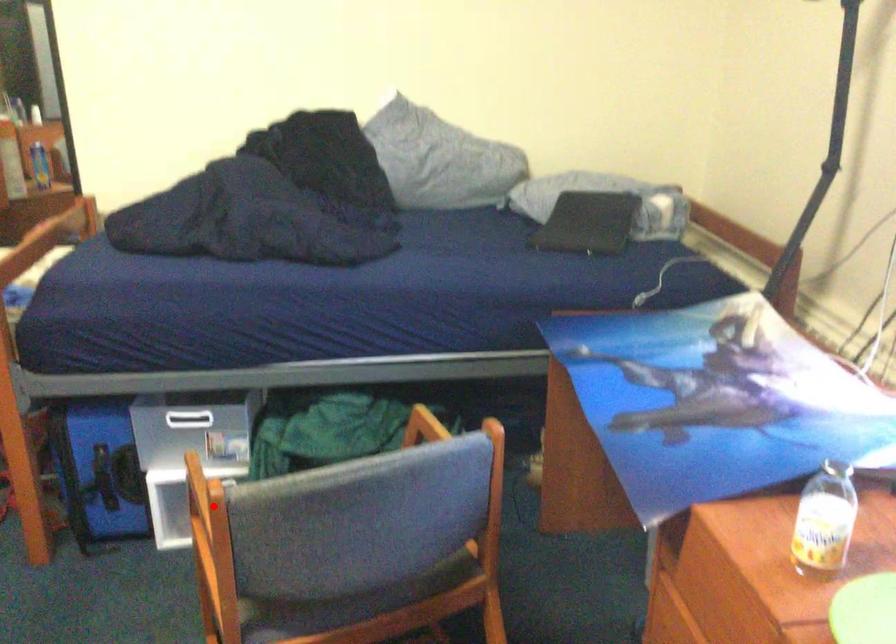
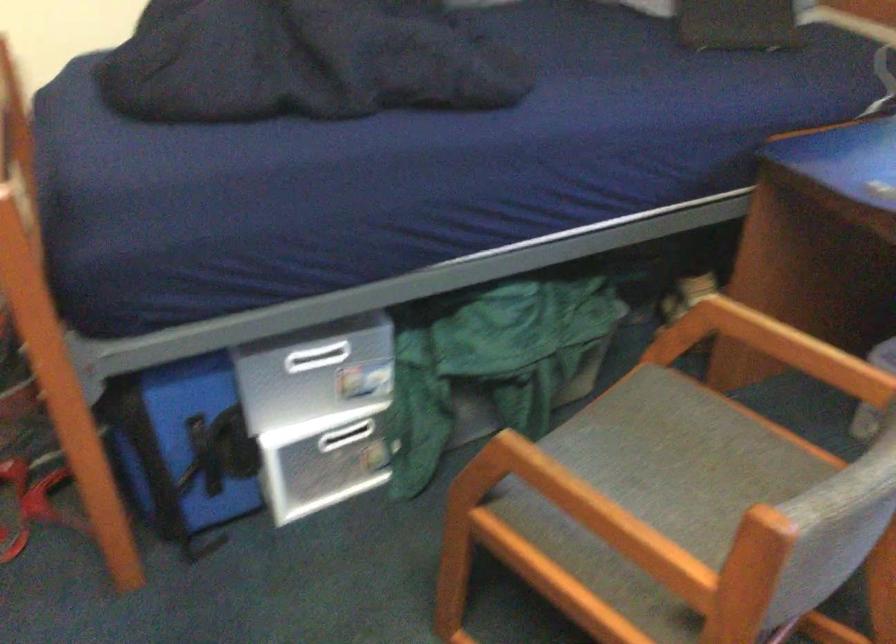
Question: I am providing you with two images of the same scene from different viewpoints. Image1 has a red point marked. In image2, the corresponding 3D location appears at what relative position? Reply with the corresponding letter.

Choices:
 (A) Closer
 (B) Farther

Answer: (A)